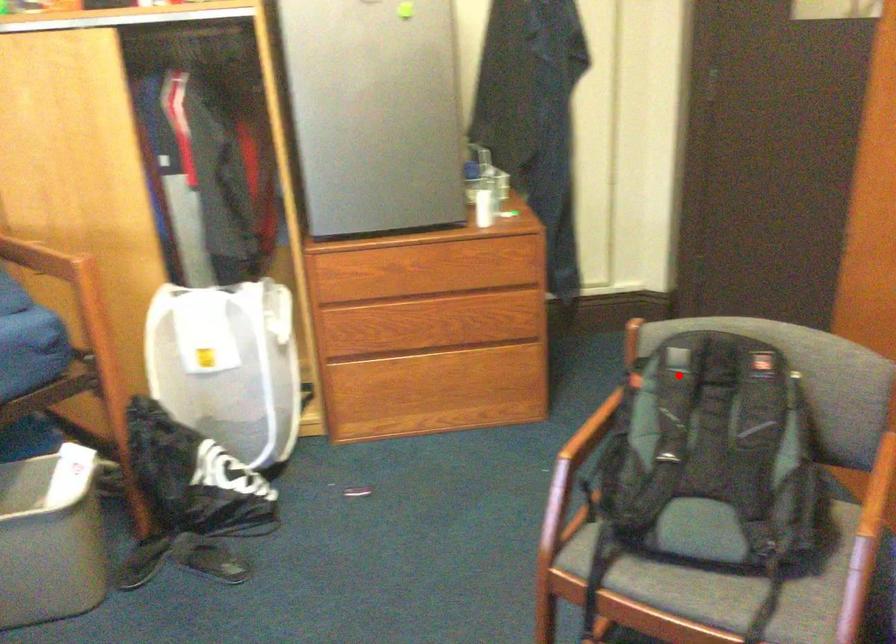
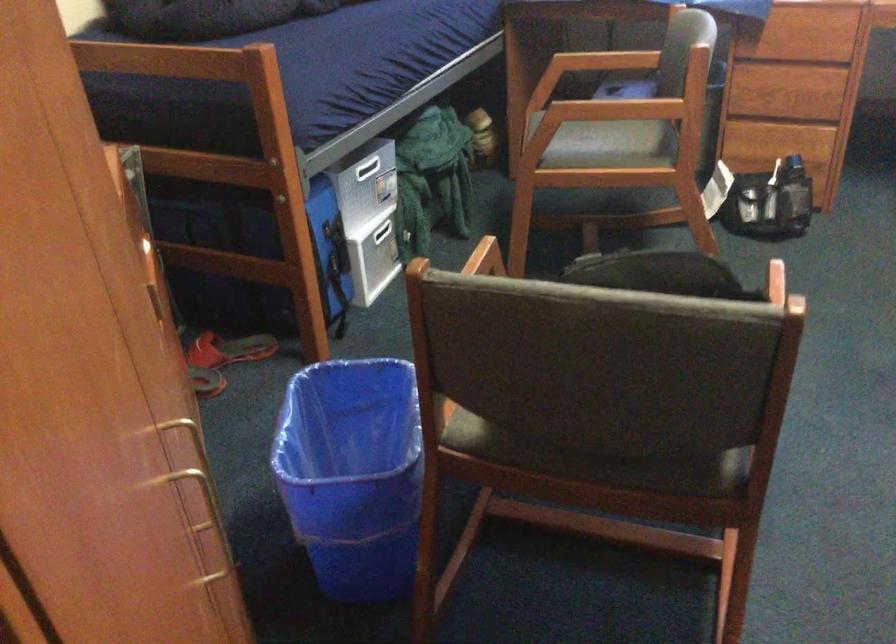
Question: I am providing you with two images of the same scene from different viewpoints. A red point is marked on the first image. Is the red point's position out of view in image 2?

Choices:
 (A) Yes
 (B) No

Answer: (B)